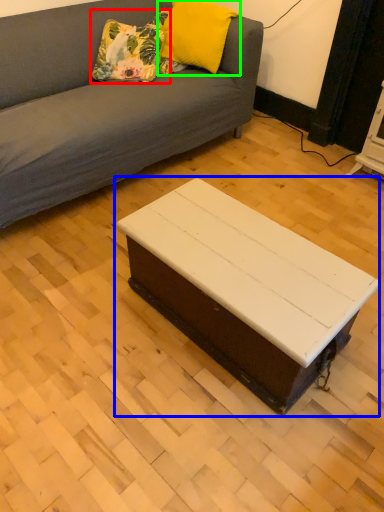
Question: Which object is the closest to the pillow (highlighted by a red box)? Choose among these: coffee table (highlighted by a blue box) or pillow (highlighted by a green box).

Choices:
 (A) coffee table
 (B) pillow

Answer: (B)